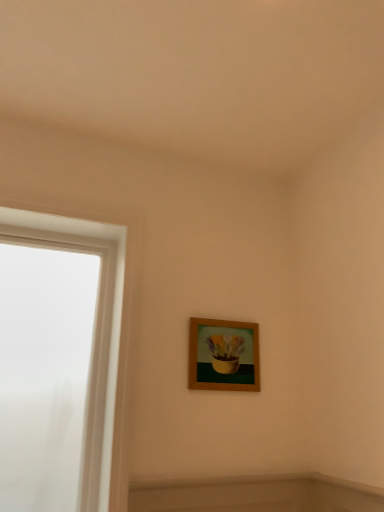
Question: In terms of size, does wooden frame at center appear bigger or smaller than white frosted glass at left?

Choices:
 (A) big
 (B) small

Answer: (B)

Question: From the image's perspective, relative to white frosted glass at left, is wooden frame at center above or below?

Choices:
 (A) above
 (B) below

Answer: (B)

Question: Is wooden frame at center in front of or behind white frosted glass at left in the image?

Choices:
 (A) behind
 (B) front

Answer: (A)

Question: Based on their sizes in the image, would you say white frosted glass at left is bigger or smaller than wooden frame at center?

Choices:
 (A) big
 (B) small

Answer: (A)

Question: Considering the positions of white frosted glass at left and wooden frame at center in the image, is white frosted glass at left wider or thinner than wooden frame at center?

Choices:
 (A) wide
 (B) thin

Answer: (A)

Question: Is white frosted glass at left inside or outside of wooden frame at center?

Choices:
 (A) inside
 (B) outside

Answer: (B)

Question: In the image, is white frosted glass at left positioned in front of or behind wooden frame at center?

Choices:
 (A) front
 (B) behind

Answer: (A)